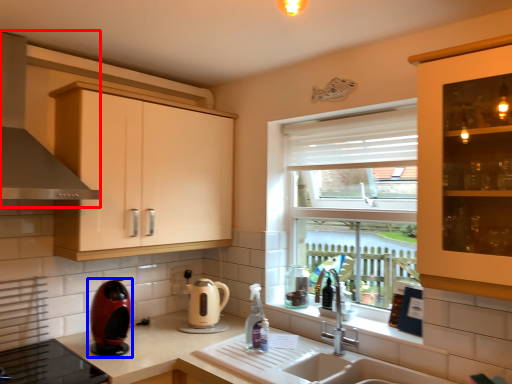
Question: Among these objects, which one is nearest to the camera, exhaust hood (highlighted by a red box) or home appliance (highlighted by a blue box)?

Choices:
 (A) exhaust hood
 (B) home appliance

Answer: (A)